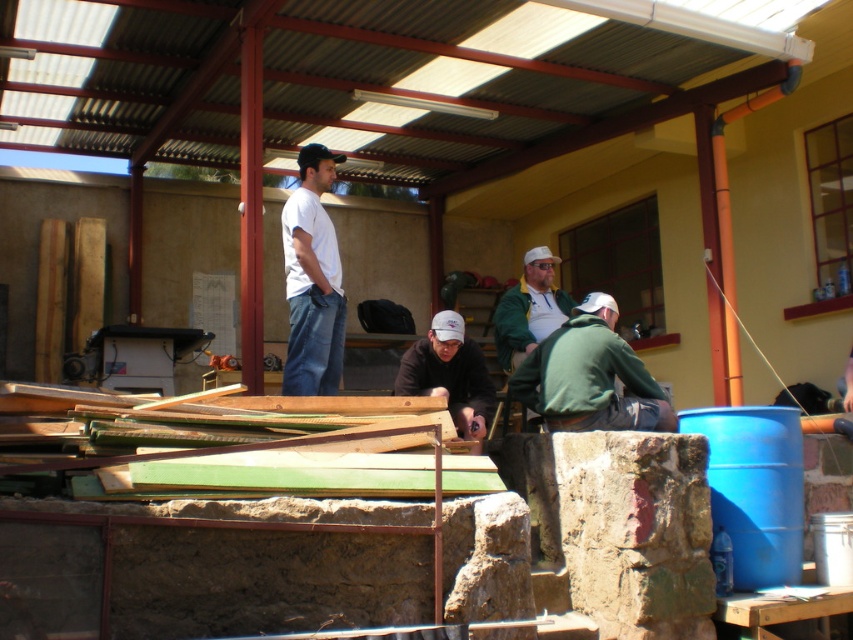
You are a construction worker who needs to identify the tallest object between the white matte baseball cap at center and the green fuzzy jacket at center. Which one is taller?

The green fuzzy jacket at center is taller than the white matte baseball cap at center according to the description provided.

You are standing in the workshop and want to hand a tool to the person wearing the white cotton shirt at center and the person wearing the green fuzzy jacket at center. Which person should you approach first to ensure you can reach them without moving too far?

You should approach the white cotton shirt at center first because it is closer to you than the green fuzzy jacket at center, so you can reach them without moving as much.